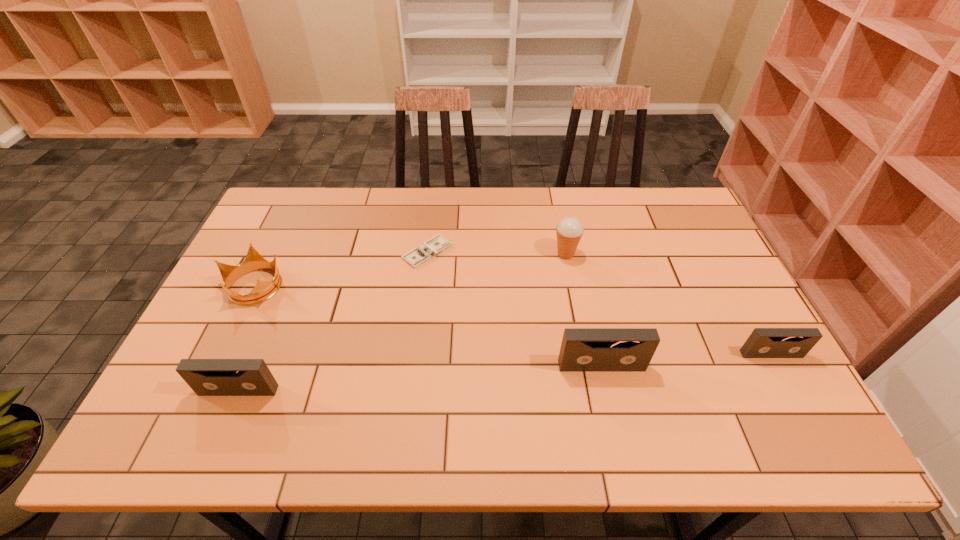
Find the location of a particular element. The height and width of the screenshot is (540, 960). blank space located 0.080m on the front-facing side of the second videotape from left to right is located at coordinates (610, 402).

Locate an element on the screen. This screenshot has width=960, height=540. free space located 0.060m on the front-facing side of the third nearest object is located at coordinates (784, 379).

Where is `free space located on the left of the icecream`? The width and height of the screenshot is (960, 540). free space located on the left of the icecream is located at coordinates (423, 254).

Locate an element on the screen. vacant space located on the front of the third object from left to right is located at coordinates (412, 378).

You are a GUI agent. You are given a task and a screenshot of the screen. Output one action in this format:
    pyautogui.click(x=<x>, y=<y>)
    Task: Click on the vacant space located 0.160m on the right of the crown
    
    Given the screenshot: What is the action you would take?
    pyautogui.click(x=338, y=286)

The image size is (960, 540). I want to click on videotape located at the left edge, so click(206, 377).

Locate an element on the screen. This screenshot has width=960, height=540. crown that is at the left edge is located at coordinates (262, 291).

The height and width of the screenshot is (540, 960). I want to click on object present at the right edge, so click(x=763, y=342).

Locate an element on the screen. object that is positioned at the near left corner is located at coordinates (x=206, y=377).

Identify the location of vacant space at the far edge. (328, 199).